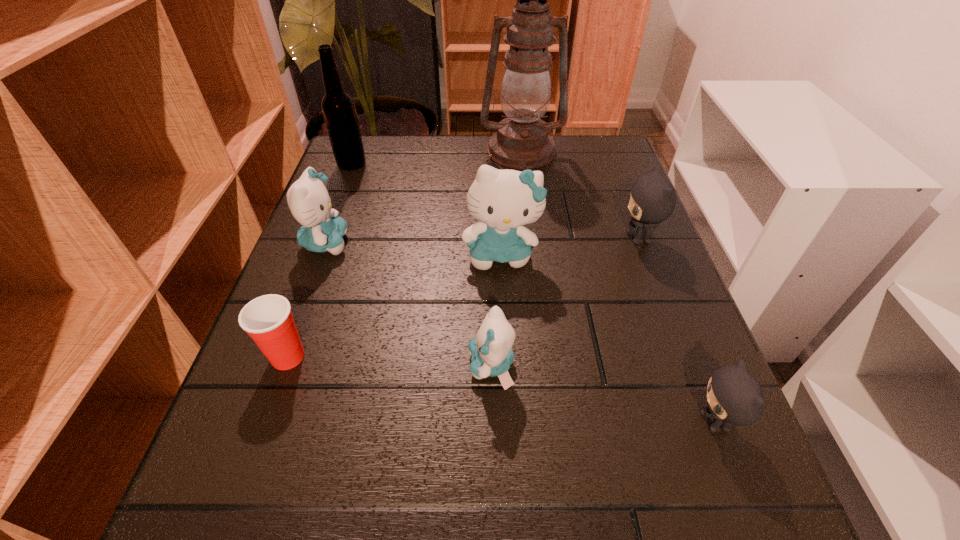
In order to click on free space between the second tallest object and the third tallest object in this screenshot , I will do `click(426, 209)`.

Identify the location of free spot between the bigger gray kitten and the nearest blue kitten. This screenshot has width=960, height=540. (564, 302).

Locate an element on the screen. This screenshot has height=540, width=960. free space between the leftmost blue kitten and the nearer gray kitten is located at coordinates (520, 332).

Identify the location of free area in between the nearest blue kitten and the leftmost kitten. (408, 304).

Locate an element on the screen. Image resolution: width=960 pixels, height=540 pixels. vacant space that's between the Dixie cup and the leftmost kitten is located at coordinates (307, 300).

The image size is (960, 540). Find the location of `free space between the smaller gray kitten and the tallest kitten`. free space between the smaller gray kitten and the tallest kitten is located at coordinates (608, 338).

Where is `free spot between the farther gray kitten and the smaller gray kitten`? The width and height of the screenshot is (960, 540). free spot between the farther gray kitten and the smaller gray kitten is located at coordinates (677, 330).

Locate which object is the second closest to the tallest object. Please provide its 2D coordinates. Your answer should be formatted as a tuple, i.e. [(x, y)], where the tuple contains the x and y coordinates of a point satisfying the conditions above.

[(502, 200)]

Identify which object is the seventh nearest to the Dixie cup. Please provide its 2D coordinates. Your answer should be formatted as a tuple, i.e. [(x, y)], where the tuple contains the x and y coordinates of a point satisfying the conditions above.

[(652, 200)]

Where is `the closest kitten to the Dixie cup`? This screenshot has height=540, width=960. the closest kitten to the Dixie cup is located at coordinates (309, 201).